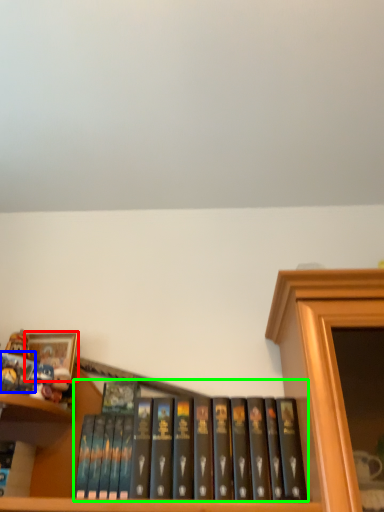
Question: Estimate the real-world distances between objects in this image. Which object is closer to picture frame (highlighted by a red box), book (highlighted by a blue box) or book (highlighted by a green box)?

Choices:
 (A) book
 (B) book

Answer: (A)